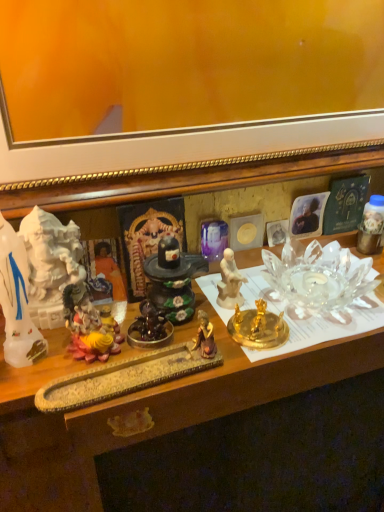
Identify the location of blank space to the left of matte yellow statue at center, placed as the 5th toy when sorted from right to left. The height and width of the screenshot is (512, 384). (38, 357).